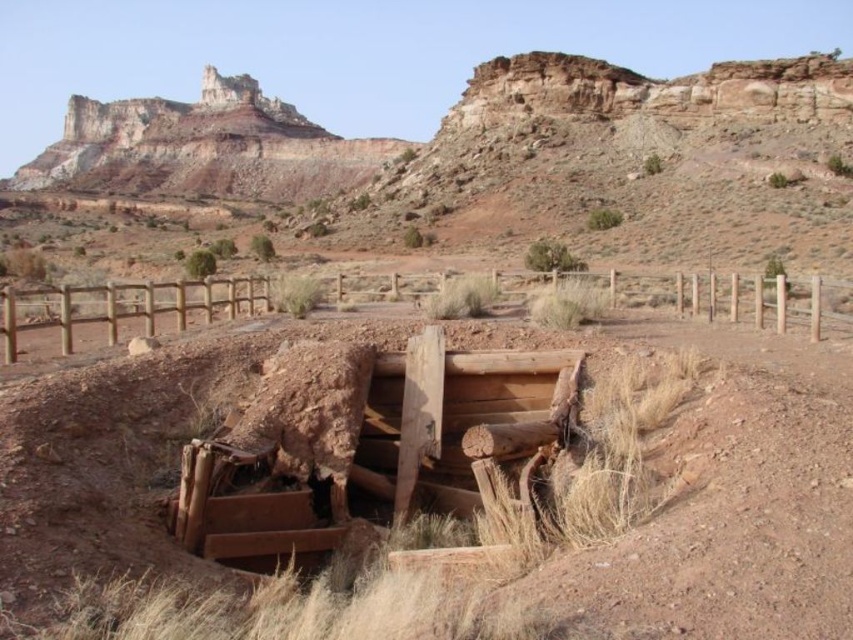
You are a hiker who needs to cross the area shown in the image. You see the brown rough wood at center and the brown wooden fence at center. Which object takes up more space in the scene?

The brown wooden fence at center occupies more space than the brown rough wood at center, so the fence takes up more space in the scene.